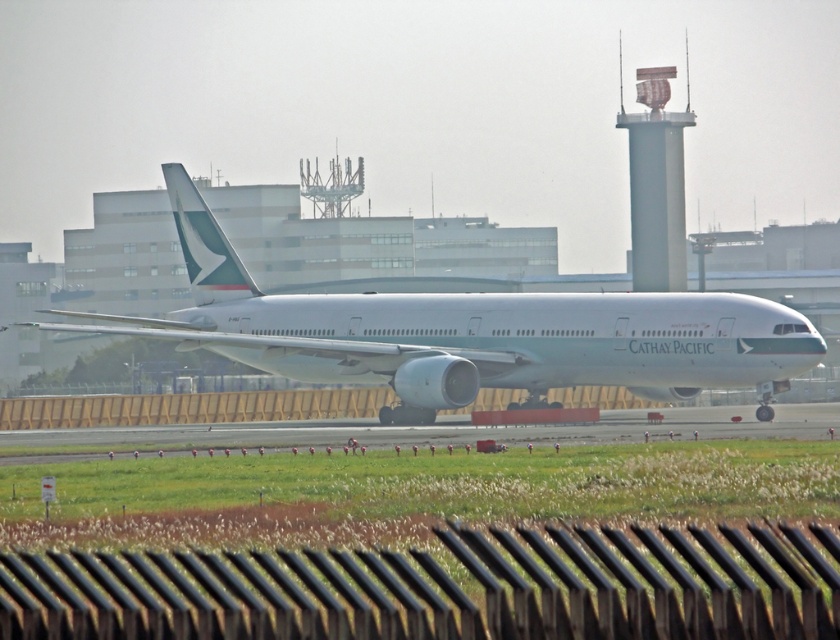
Who is lower down, white glossy airplane at center or smooth gray control tower at upper right?

white glossy airplane at center is lower down.

Is white glossy airplane at center smaller than smooth gray control tower at upper right?

Correct, white glossy airplane at center occupies less space than smooth gray control tower at upper right.

Does point (801, 353) come behind point (647, 280)?

No, it is in front of (647, 280).

Identify the location of white glossy airplane at center. (468, 332).